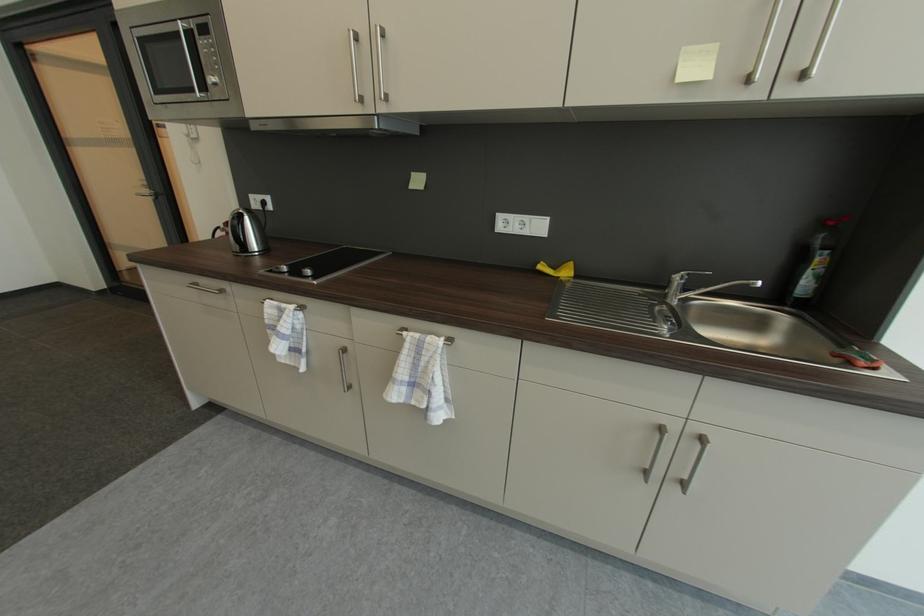
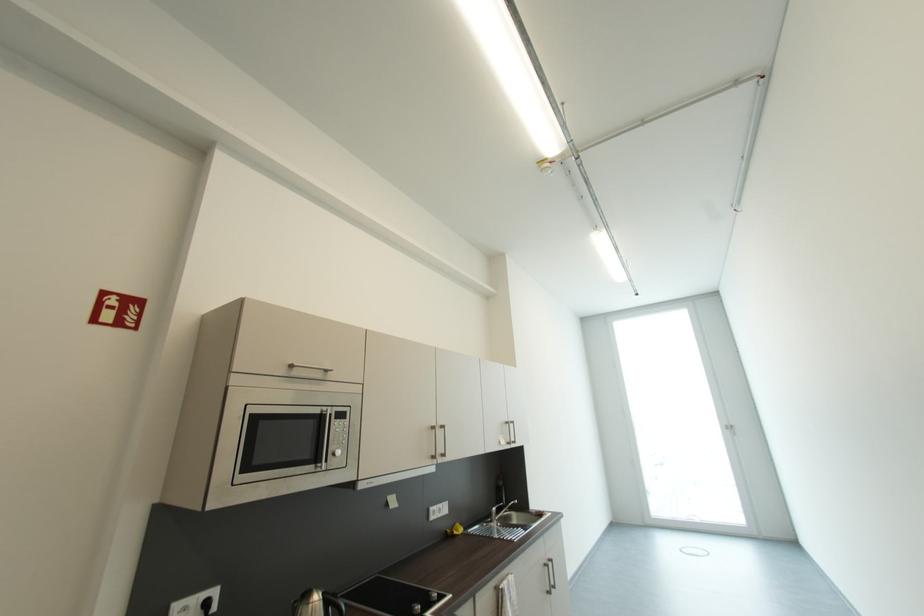
Locate, in the second image, the point that corresponds to point 271,204 in the first image.

(213, 605)